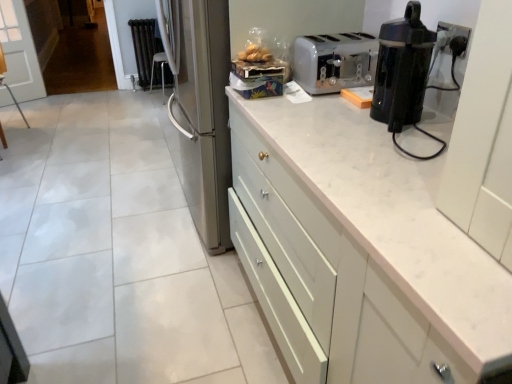
Where is `free spot to the left of black plastic coffee maker at upper right`? The image size is (512, 384). free spot to the left of black plastic coffee maker at upper right is located at coordinates (348, 119).